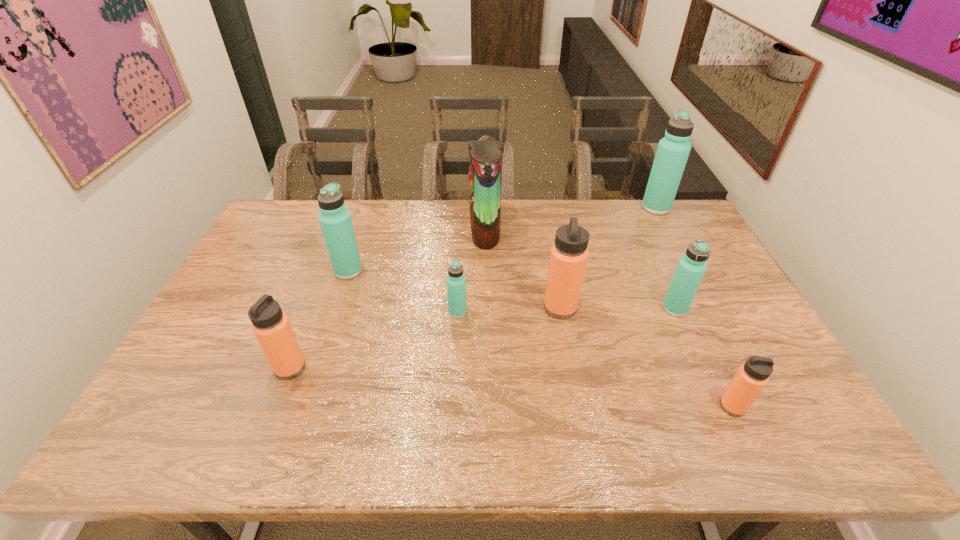
Locate an element on the screen. vacant space located 0.170m on the front of the second aqua thermos bottle from right to left is located at coordinates (701, 366).

You are a GUI agent. You are given a task and a screenshot of the screen. Output one action in this format:
    pyautogui.click(x=<x>, y=<y>)
    Task: Click on the blank space located 0.050m on the right of the second biggest orange thermos bottle
    The width and height of the screenshot is (960, 540).
    Given the screenshot: What is the action you would take?
    pyautogui.click(x=325, y=368)

At what (x,y) coordinates should I click in order to perform the action: click on vacant space located on the back of the smallest aqua thermos bottle. Please return your answer as a coordinate pair (x, y). The height and width of the screenshot is (540, 960). Looking at the image, I should click on (462, 239).

Where is `vacant area located on the left of the nearest orange thermos bottle`? The height and width of the screenshot is (540, 960). vacant area located on the left of the nearest orange thermos bottle is located at coordinates (690, 407).

At what (x,y) coordinates should I click in order to perform the action: click on thermos bottle positioned at the far edge. Please return your answer as a coordinate pair (x, y). This screenshot has width=960, height=540. Looking at the image, I should click on (673, 150).

Identify the location of parrot that is at the far edge. (486, 155).

I want to click on object that is at the far right corner, so click(673, 150).

Identify the location of free space at the far edge of the desktop. The image size is (960, 540). (554, 200).

I want to click on vacant space at the near edge, so click(424, 427).

You are a GUI agent. You are given a task and a screenshot of the screen. Output one action in this format:
    pyautogui.click(x=<x>, y=<y>)
    Task: Click on the vacant area at the left edge
    The image size is (960, 540).
    Given the screenshot: What is the action you would take?
    pyautogui.click(x=283, y=265)